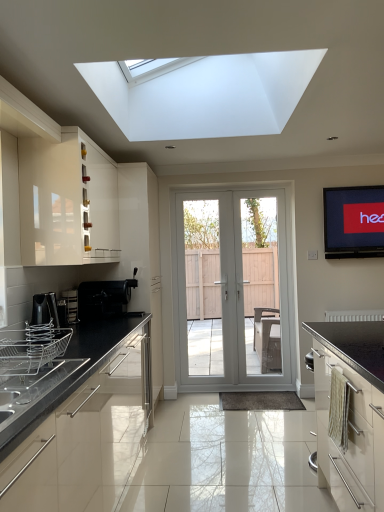
Question: Does satin silver dish rack at left, which is the fourth appliance from back to front, have a larger size compared to white glossy door at center, acting as the second screen door starting from the left?

Choices:
 (A) yes
 (B) no

Answer: (B)

Question: From a real-world perspective, is satin silver dish rack at left, the first appliance viewed from the front, located higher than white glossy door at center, which ranks as the first screen door in right-to-left order?

Choices:
 (A) yes
 (B) no

Answer: (B)

Question: Is white glossy door at center, which ranks as the first screen door in right-to-left order, at the back of satin silver dish rack at left, which is the fourth appliance from back to front?

Choices:
 (A) yes
 (B) no

Answer: (B)

Question: Can you confirm if satin silver dish rack at left, the first appliance viewed from the front, is taller than white glossy door at center, acting as the second screen door starting from the left?

Choices:
 (A) yes
 (B) no

Answer: (B)

Question: Does satin silver dish rack at left, the first appliance viewed from the front, lie behind white glossy door at center, which ranks as the first screen door in right-to-left order?

Choices:
 (A) no
 (B) yes

Answer: (A)

Question: From the image's perspective, is satin silver dish rack at left, the first appliance viewed from the front, under white glossy door at center, which ranks as the first screen door in right-to-left order?

Choices:
 (A) no
 (B) yes

Answer: (B)

Question: Would you say matte black oven at lower right, the second cabinetry positioned from the left, contains satin silver dish rack at left, the first appliance viewed from the front?

Choices:
 (A) yes
 (B) no

Answer: (B)

Question: Is matte black oven at lower right, acting as the 2th cabinetry starting from the back, oriented towards satin silver dish rack at left, the first appliance viewed from the front?

Choices:
 (A) no
 (B) yes

Answer: (A)

Question: Can you confirm if matte black oven at lower right, the second cabinetry positioned from the left, is smaller than satin silver dish rack at left, which is the fourth appliance from back to front?

Choices:
 (A) no
 (B) yes

Answer: (A)

Question: Does matte black oven at lower right, marked as the first cabinetry in a front-to-back arrangement, have a greater height compared to satin silver dish rack at left, which is the fourth appliance from back to front?

Choices:
 (A) no
 (B) yes

Answer: (B)

Question: Is matte black oven at lower right, acting as the 1th cabinetry starting from the bottom, positioned beyond the bounds of satin silver dish rack at left, which is the fourth appliance from back to front?

Choices:
 (A) yes
 (B) no

Answer: (A)

Question: From a real-world perspective, is matte black oven at lower right, which is the first cabinetry in right-to-left order, beneath satin silver dish rack at left, the first appliance viewed from the front?

Choices:
 (A) no
 (B) yes

Answer: (B)

Question: Does black matte coffee machine at left, placed as the 4th appliance when sorted from front to back, have a lesser width compared to satin silver toaster at left, placed as the second appliance when sorted from back to front?

Choices:
 (A) yes
 (B) no

Answer: (B)